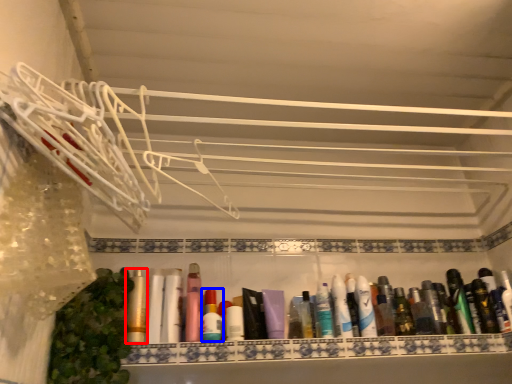
Question: Among these objects, which one is nearest to the camera, toiletry (highlighted by a red box) or toiletry (highlighted by a blue box)?

Choices:
 (A) toiletry
 (B) toiletry

Answer: (A)